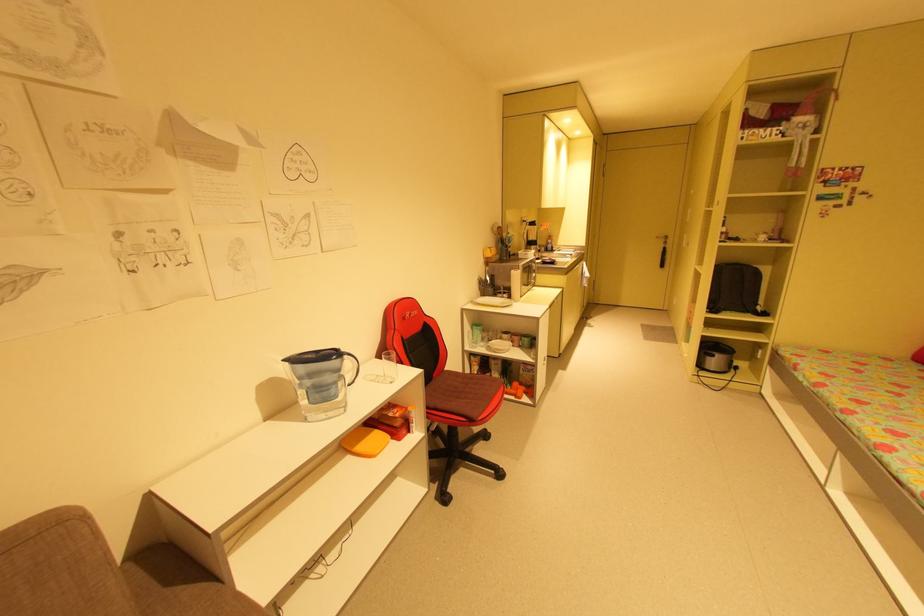
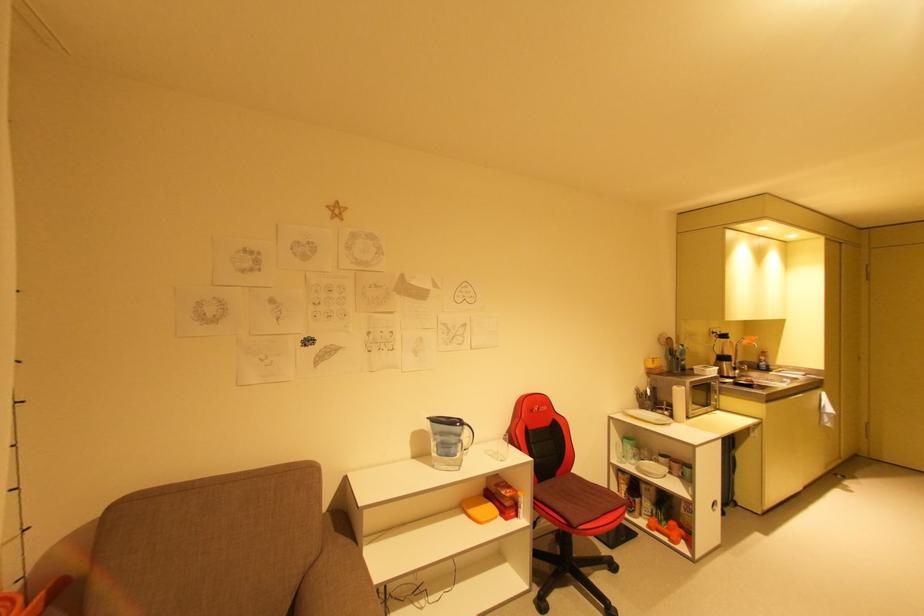
In the second image, find the point that corresponds to (560,253) in the first image.

(776, 373)